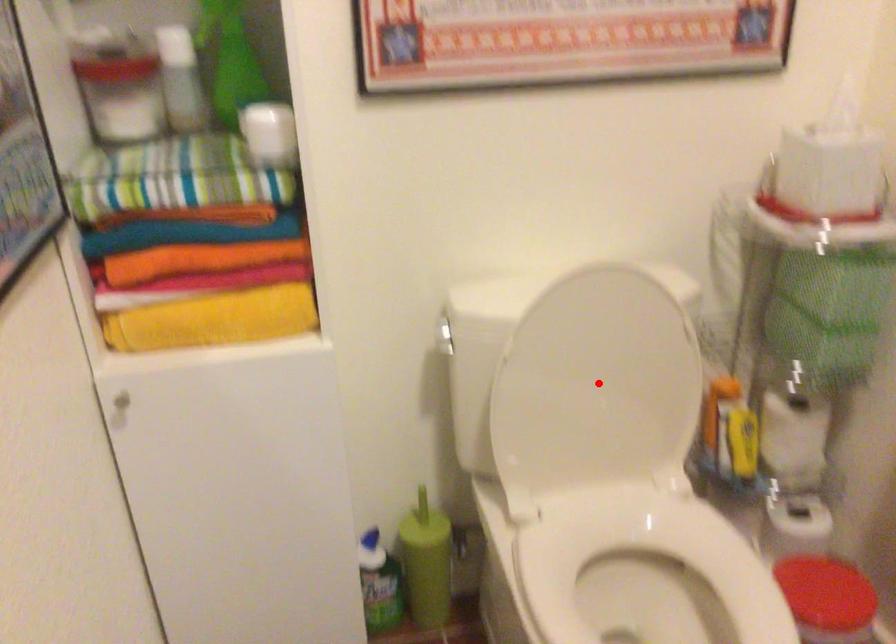
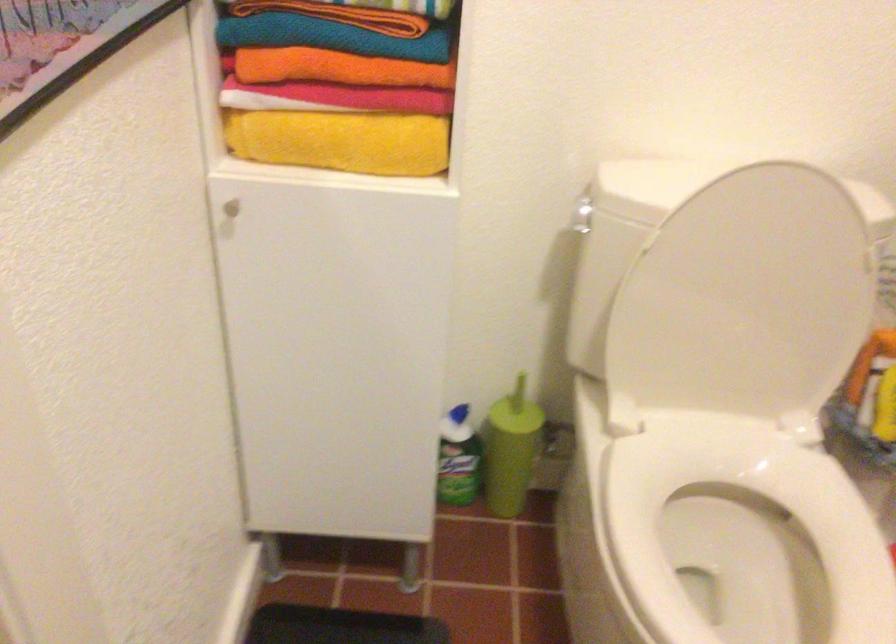
In the second image, find the point that corresponds to the highlighted location in the first image.

(744, 299)